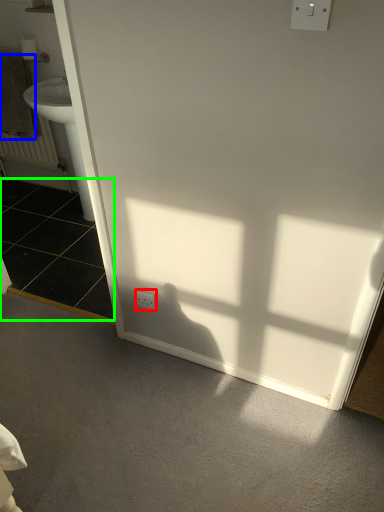
Question: Which is farther away from electric outlet (highlighted by a red box)? towel/napkin (highlighted by a blue box) or tile (highlighted by a green box)?

Choices:
 (A) towel/napkin
 (B) tile

Answer: (A)